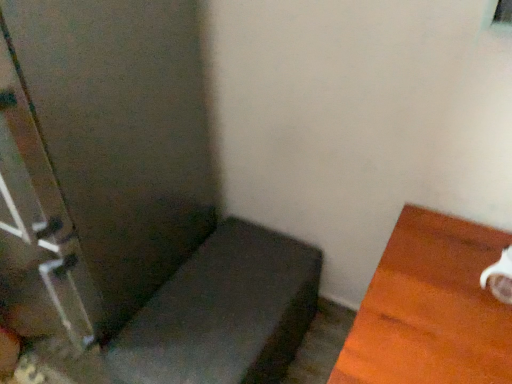
In order to click on free spot above white glossy mug at right, which is the first furniture from right to left (from a real-world perspective) in this screenshot , I will do `click(440, 301)`.